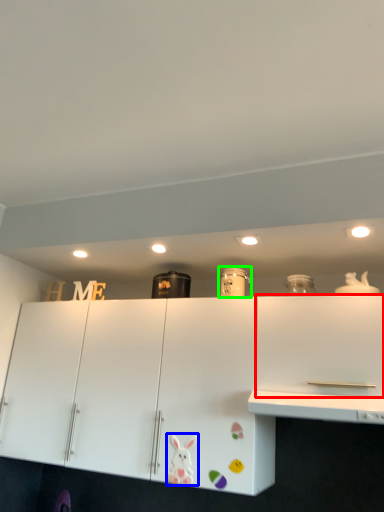
Question: Estimate the real-world distances between objects in this image. Which object is farther from cabinetry (highlighted by a red box), animal (highlighted by a blue box) or appliance (highlighted by a green box)?

Choices:
 (A) animal
 (B) appliance

Answer: (A)